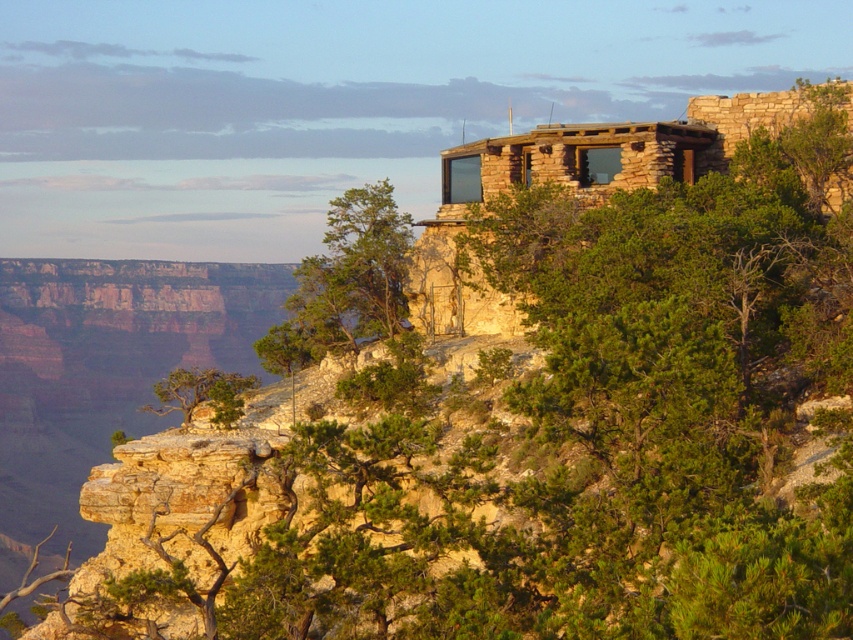
You are standing at the base of the cliffside structure and want to reach the green leafy tree at upper right. The path is steep and rocky. If you can climb 100 meters vertically, will you be able to reach the tree?

The green leafy tree at upper right is 86.86 meters away from the viewer. Since you can climb 100 meters vertically, you will be able to reach the green leafy tree at upper right.

You are a hiker who wants to take a photo of the cliffside structure. You have two trees in your viewfinder, the green leafy tree at upper right and the green rough bark tree at center. Which tree is more to the right?

The green leafy tree at upper right is more to the right than the green rough bark tree at center.

You are an architect designing a new path that needs to pass between the green leafy tree at upper right and the green rough bark tree at center. Based on their positions, which tree will the path come closer to first when approaching from the front of the image?

The path will come closer to the green leafy tree at upper right first because it is in front of the green rough bark tree at center.